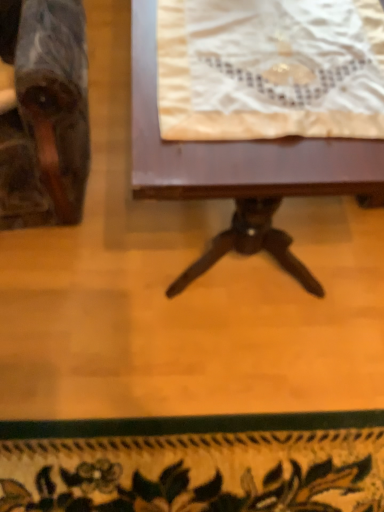
Question: From a real-world perspective, is wooden table at center above or below marble-like wooden chair at left?

Choices:
 (A) above
 (B) below

Answer: (B)

Question: Considering the relative positions of wooden table at center and marble-like wooden chair at left in the image provided, is wooden table at center to the left or to the right of marble-like wooden chair at left?

Choices:
 (A) right
 (B) left

Answer: (A)

Question: Which object is positioned farthest from the white lace cloth at upper center?

Choices:
 (A) marble-like wooden chair at left
 (B) wooden table at center

Answer: (A)

Question: Estimate the real-world distances between objects in this image. Which object is closer to the marble-like wooden chair at left?

Choices:
 (A) wooden table at center
 (B) white lace cloth at upper center

Answer: (A)